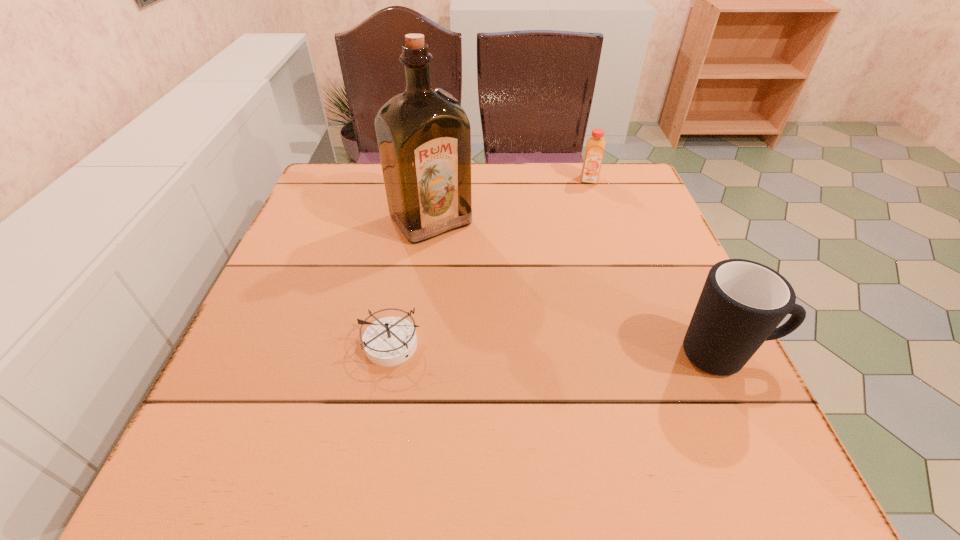
Locate an element on the screen. the shortest object is located at coordinates (389, 341).

The image size is (960, 540). I want to click on the second tallest object, so click(742, 302).

Locate an element on the screen. The image size is (960, 540). the rightmost object is located at coordinates (742, 302).

Where is `liquor`? The image size is (960, 540). liquor is located at coordinates (424, 137).

Identify the location of the tallest object. (424, 137).

The width and height of the screenshot is (960, 540). I want to click on orange juice, so click(x=595, y=145).

This screenshot has height=540, width=960. In order to click on the second shortest object in this screenshot , I will do `click(595, 145)`.

Locate an element on the screen. free region located 0.060m on the right of the shortest object is located at coordinates (456, 345).

What are the coordinates of `vacant position located on the label of the liquor` in the screenshot? It's located at (468, 265).

Where is `vacant space located on the label of the liquor`? The height and width of the screenshot is (540, 960). vacant space located on the label of the liquor is located at coordinates (483, 281).